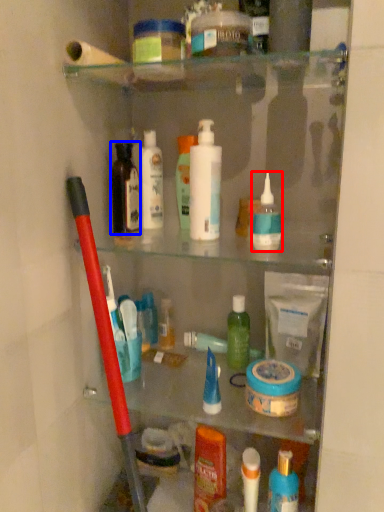
Question: Which point is further to the camera, toiletry (highlighted by a red box) or toiletry (highlighted by a blue box)?

Choices:
 (A) toiletry
 (B) toiletry

Answer: (B)